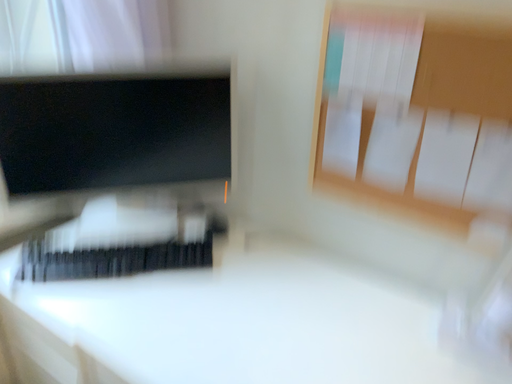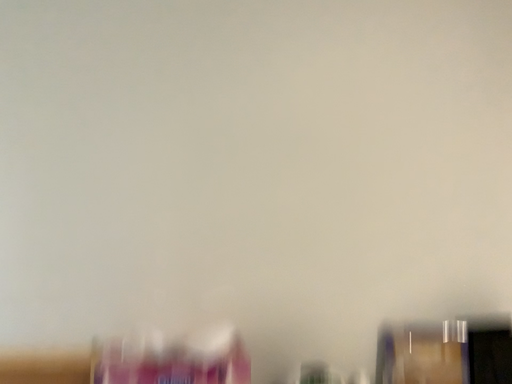
Question: Which way did the camera rotate in the video?

Choices:
 (A) rotated downward
 (B) rotated upward

Answer: (B)